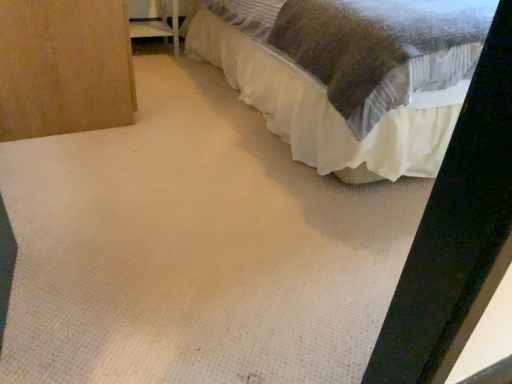
Question: Can you confirm if white plastic shelf at upper left is thinner than white textured bed at upper right?

Choices:
 (A) yes
 (B) no

Answer: (A)

Question: Is white textured bed at upper right completely or partially inside white plastic shelf at upper left?

Choices:
 (A) no
 (B) yes

Answer: (A)

Question: Is white plastic shelf at upper left completely or partially outside of white textured bed at upper right?

Choices:
 (A) no
 (B) yes

Answer: (B)

Question: Considering the relative sizes of white plastic shelf at upper left and white textured bed at upper right in the image provided, is white plastic shelf at upper left wider than white textured bed at upper right?

Choices:
 (A) no
 (B) yes

Answer: (A)

Question: From a real-world perspective, is white plastic shelf at upper left located higher than white textured bed at upper right?

Choices:
 (A) yes
 (B) no

Answer: (B)

Question: Is white plastic shelf at upper left with white textured bed at upper right?

Choices:
 (A) no
 (B) yes

Answer: (A)

Question: From the image's perspective, is white textured bed at upper right located above white plastic shelf at upper left?

Choices:
 (A) yes
 (B) no

Answer: (B)

Question: Are white textured bed at upper right and white plastic shelf at upper left making contact?

Choices:
 (A) yes
 (B) no

Answer: (B)

Question: Can you confirm if white textured bed at upper right is positioned to the right of white plastic shelf at upper left?

Choices:
 (A) no
 (B) yes

Answer: (B)

Question: Can you confirm if white textured bed at upper right is taller than white plastic shelf at upper left?

Choices:
 (A) yes
 (B) no

Answer: (A)

Question: Is white textured bed at upper right outside white plastic shelf at upper left?

Choices:
 (A) yes
 (B) no

Answer: (A)

Question: From the image's perspective, does white textured bed at upper right appear lower than white plastic shelf at upper left?

Choices:
 (A) no
 (B) yes

Answer: (B)

Question: Based on their positions, is white plastic shelf at upper left located to the left or right of white textured bed at upper right?

Choices:
 (A) left
 (B) right

Answer: (A)